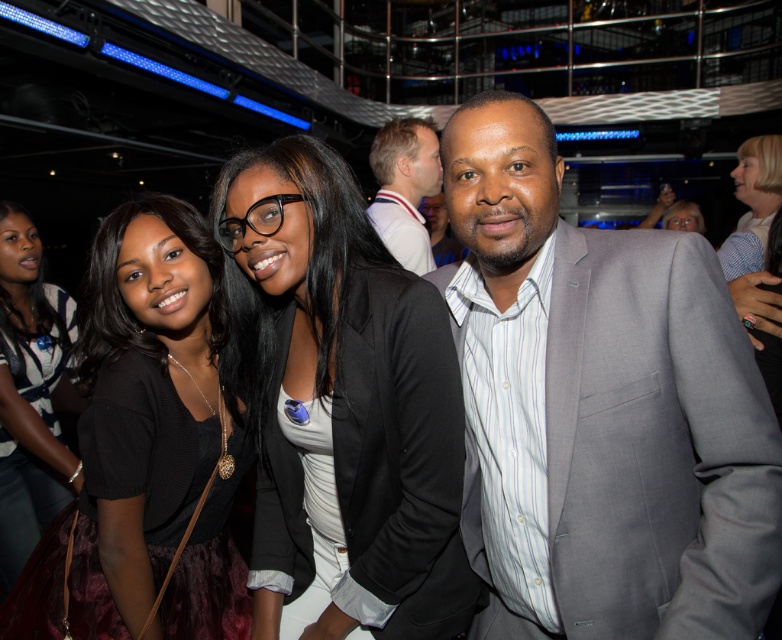
You are at a party and want to take a photo of two points in the image. The first point is at coordinates point (461,618) and the second is at point (16,371). Which point is closer to the camera?

Point (461,618) is in front of point (16,371), so it is closer to the camera.